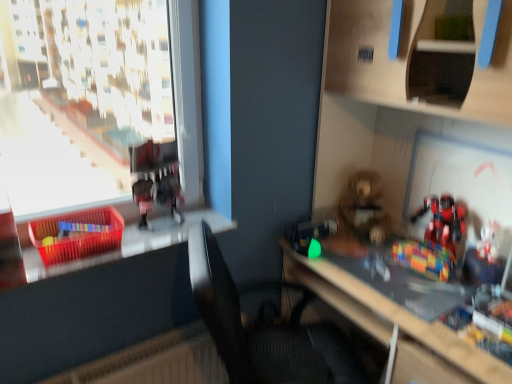
Question: Is shiny metallic robot at right, which ranks as the second toy in right-to-left order, located within black fabric chair at center?

Choices:
 (A) no
 (B) yes

Answer: (A)

Question: Is black fabric chair at center positioned with its back to shiny metallic robot at right, the third toy in the left-to-right sequence?

Choices:
 (A) yes
 (B) no

Answer: (B)

Question: From a real-world perspective, is black fabric chair at center positioned over shiny metallic robot at right, the third toy in the left-to-right sequence, based on gravity?

Choices:
 (A) yes
 (B) no

Answer: (B)

Question: Does black fabric chair at center have a smaller size compared to shiny metallic robot at right, the third toy in the left-to-right sequence?

Choices:
 (A) yes
 (B) no

Answer: (B)

Question: Would you say black fabric chair at center is a long distance from shiny metallic robot at right, which ranks as the second toy in right-to-left order?

Choices:
 (A) yes
 (B) no

Answer: (B)

Question: From the image's perspective, relative to translucent plastic basket at left, is translucent plastic crate at left above or below?

Choices:
 (A) below
 (B) above

Answer: (B)

Question: Which is correct: translucent plastic crate at left is inside translucent plastic basket at left, or outside of it?

Choices:
 (A) outside
 (B) inside

Answer: (A)

Question: Is translucent plastic crate at left taller or shorter than translucent plastic basket at left?

Choices:
 (A) short
 (B) tall

Answer: (B)

Question: Is point (39, 249) positioned closer to the camera than point (58, 264)?

Choices:
 (A) farther
 (B) closer

Answer: (A)

Question: Do you think translucent plastic basket at left is within black fabric chair at center, or outside of it?

Choices:
 (A) inside
 (B) outside

Answer: (B)

Question: Visually, is translucent plastic basket at left positioned to the left or to the right of black fabric chair at center?

Choices:
 (A) left
 (B) right

Answer: (A)

Question: Is translucent plastic basket at left in front of or behind black fabric chair at center in the image?

Choices:
 (A) behind
 (B) front

Answer: (A)

Question: From the image's perspective, is translucent plastic basket at left above or below black fabric chair at center?

Choices:
 (A) below
 (B) above

Answer: (B)

Question: Is metallic red robot at upper left, which is the 4th toy in right-to-left order, to the left or to the right of black fabric chair at center in the image?

Choices:
 (A) right
 (B) left

Answer: (B)

Question: Relative to black fabric chair at center, is metallic red robot at upper left, placed as the 1th toy when sorted from left to right, in front or behind?

Choices:
 (A) behind
 (B) front

Answer: (A)